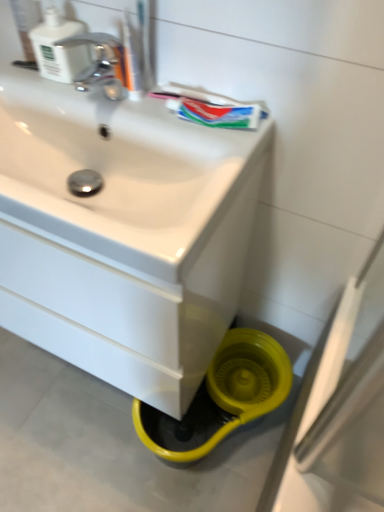
Question: Is point (77, 47) closer or farther from the camera than point (254, 103)?

Choices:
 (A) closer
 (B) farther

Answer: (B)

Question: Based on their sizes in the image, would you say white plastic soap dispenser at upper left is bigger or smaller than green matte toothpaste at upper center?

Choices:
 (A) big
 (B) small

Answer: (A)

Question: Which of these objects is positioned closest to the white plastic soap dispenser at upper left?

Choices:
 (A) white glossy sink at center
 (B) translucent plastic toothbrush at upper center
 (C) green matte toothpaste at upper center

Answer: (B)

Question: Based on their relative distances, which object is farther from the white glossy sink at center?

Choices:
 (A) translucent plastic toothbrush at upper center
 (B) white plastic soap dispenser at upper left
 (C) green matte toothpaste at upper center

Answer: (A)